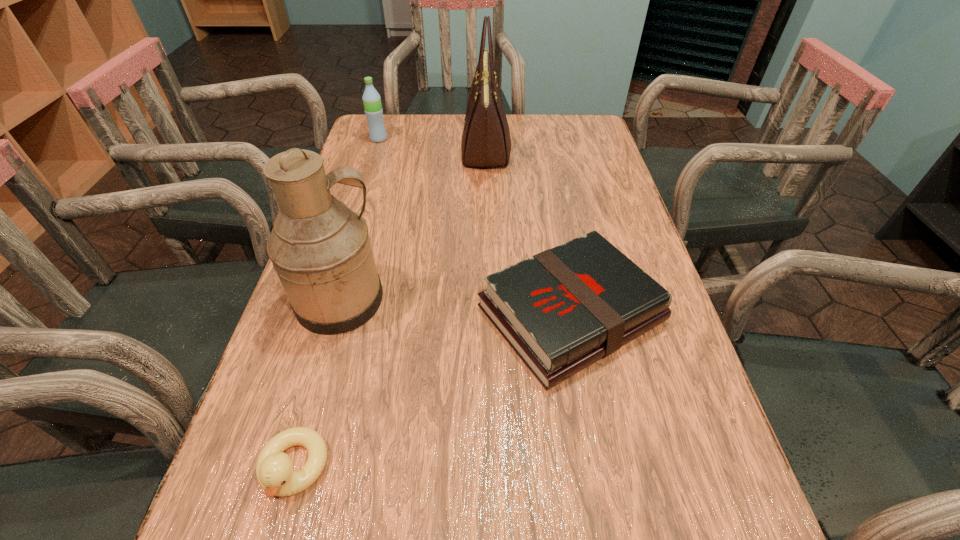
What are the coordinates of `vacant space at the right edge of the desktop` in the screenshot? It's located at (668, 323).

In the image, there is a desktop. Where is `vacant space at the far right corner`? The height and width of the screenshot is (540, 960). vacant space at the far right corner is located at coordinates (547, 119).

Where is `vacant space in between the pitcher and the hardback book`? The width and height of the screenshot is (960, 540). vacant space in between the pitcher and the hardback book is located at coordinates (456, 307).

Identify the location of unoccupied position between the handbag and the pitcher. (414, 225).

Where is `blank region between the nearest object and the hardback book`? blank region between the nearest object and the hardback book is located at coordinates (432, 391).

I want to click on vacant space that's between the hardback book and the water bottle, so click(475, 226).

You are a GUI agent. You are given a task and a screenshot of the screen. Output one action in this format:
    pyautogui.click(x=<x>, y=<y>)
    Task: Click on the free space between the hardback book and the handbag
    This screenshot has height=540, width=960.
    Given the screenshot: What is the action you would take?
    pyautogui.click(x=529, y=232)

Where is `empty location between the water bottle and the handbag`? This screenshot has width=960, height=540. empty location between the water bottle and the handbag is located at coordinates (432, 144).

Locate an element on the screen. vacant region between the handbag and the pitcher is located at coordinates (414, 225).

The height and width of the screenshot is (540, 960). I want to click on vacant region between the hardback book and the water bottle, so coord(475,226).